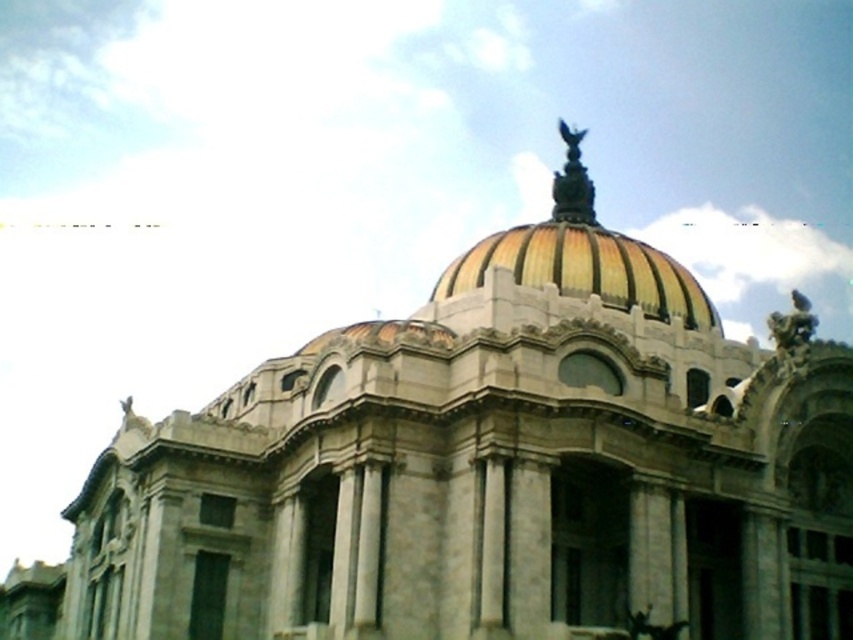
Question: Is gold mosaic dome at center smaller than bronze statue at upper right?

Choices:
 (A) no
 (B) yes

Answer: (B)

Question: Which of the following is the farthest from the observer?

Choices:
 (A) bronze statue at upper right
 (B) gold metallic statue at top

Answer: (B)

Question: Among these points, which one is farthest from the camera?

Choices:
 (A) (807, 352)
 (B) (621, 305)

Answer: (B)

Question: Does gold metallic statue at top have a larger size compared to bronze statue at upper right?

Choices:
 (A) no
 (B) yes

Answer: (A)

Question: Does gold mosaic dome at center have a larger size compared to bronze statue at upper right?

Choices:
 (A) yes
 (B) no

Answer: (B)

Question: Which object appears closest to the camera in this image?

Choices:
 (A) bronze statue at upper right
 (B) gold mosaic dome at center
 (C) gold metallic statue at top

Answer: (A)